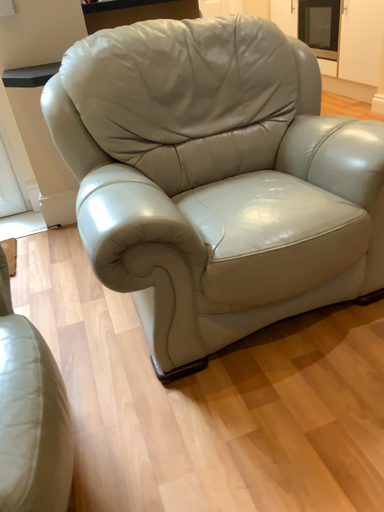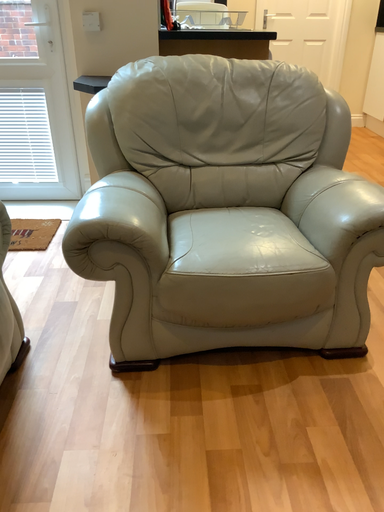
Question: Which way did the camera rotate in the video?

Choices:
 (A) rotated right
 (B) rotated left

Answer: (B)